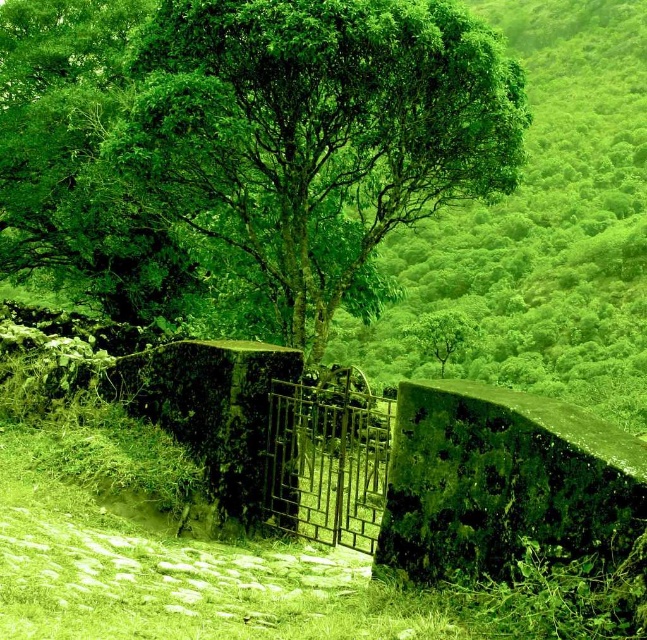
Question: Can you confirm if green leafy tree at center is positioned below rusty metal gate at center?

Choices:
 (A) yes
 (B) no

Answer: (B)

Question: Which object is farther from the camera taking this photo?

Choices:
 (A) green leafy tree at center
 (B) rusty metal gate at center

Answer: (B)

Question: Which point appears closest to the camera in this image?

Choices:
 (A) (344, 480)
 (B) (193, 186)

Answer: (A)

Question: Is green leafy tree at center below rusty metal gate at center?

Choices:
 (A) yes
 (B) no

Answer: (B)

Question: Which of the following is the closest to the observer?

Choices:
 (A) rusty metal gate at center
 (B) green leafy tree at center

Answer: (B)

Question: Can you confirm if green leafy tree at center is positioned above rusty metal gate at center?

Choices:
 (A) no
 (B) yes

Answer: (B)